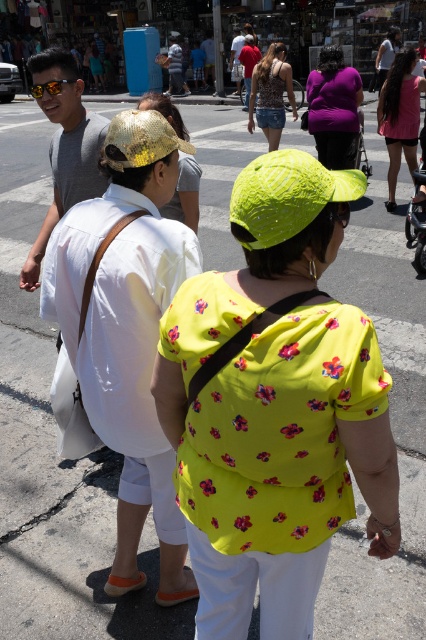
Measure the distance between point (400, 99) and camera.

Point (400, 99) is 7.93 meters away from camera.

Does point (382, 108) lie behind point (293, 109)?

No, (382, 108) is closer to viewer.

The image size is (426, 640). What do you see at coordinates (400, 116) in the screenshot? I see `pink fabric dress at upper right` at bounding box center [400, 116].

At what (x,y) coordinates should I click in order to perform the action: click on pink fabric dress at upper right. Please return your answer as a coordinate pair (x, y). This screenshot has width=426, height=640. Looking at the image, I should click on pos(400,116).

The width and height of the screenshot is (426, 640). Describe the element at coordinates (275, 406) in the screenshot. I see `matte yellow cap at center` at that location.

Does matte yellow cap at center have a larger size compared to shiny gold hat at center?

Yes.

The width and height of the screenshot is (426, 640). What are the coordinates of `matte yellow cap at center` in the screenshot? It's located at (275, 406).

The height and width of the screenshot is (640, 426). Identify the location of matte yellow cap at center. (275, 406).

Looking at this image, between matte yellow cap at center and patterned fabric dress at center, which one is positioned lower?

matte yellow cap at center is lower down.

Can you confirm if matte yellow cap at center is positioned to the right of patterned fabric dress at center?

Incorrect, matte yellow cap at center is not on the right side of patterned fabric dress at center.

Is point (308, 401) positioned behind point (282, 81)?

That is False.

Locate an element on the screen. matte yellow cap at center is located at coordinates (275, 406).